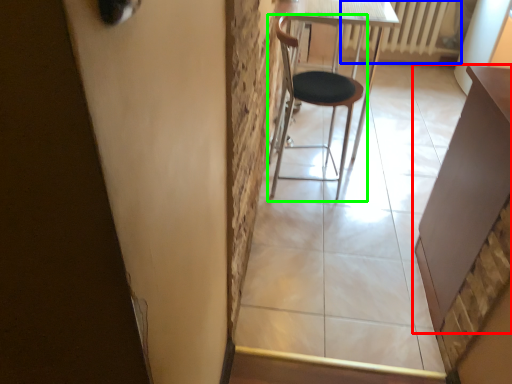
Question: Which object is positioned farthest from table (highlighted by a red box)? Select from radiator (highlighted by a blue box) and chair (highlighted by a green box).

Choices:
 (A) radiator
 (B) chair

Answer: (A)